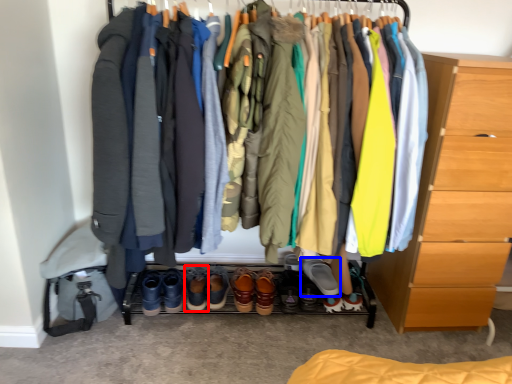
Question: Which object is further to the camera taking this photo, footwear (highlighted by a red box) or footwear (highlighted by a blue box)?

Choices:
 (A) footwear
 (B) footwear

Answer: (A)